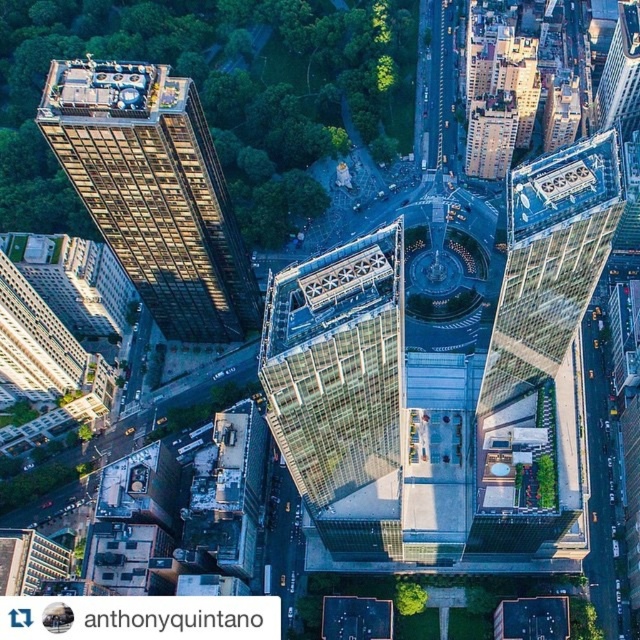
You are a city planner evaluating the urban skyline. You need to determine if the dark brown glass skyscraper at left will block the view of the transparent glass skyscraper at center from the park. Based on their heights, what do you conclude?

The dark brown glass skyscraper at left has a lesser height compared to transparent glass skyscraper at center, so it will not block the view of the transparent glass skyscraper at center from the park.

You are a drone operator flying over the city and need to deliver a package to the transparent glass skyscraper at center. However, you notice another dark brown glass skyscraper at left in your path. Based on your observation, which skyscraper is closer to you from your current position?

The dark brown glass skyscraper at left is closer to you because the transparent glass skyscraper at center is positioned behind it.

You are a drone operator tasked with flying a drone between the two skyscrapers. The drone has a maximum flight distance of 200 meters. Can you safely fly the drone between the dark brown glass skyscraper at left and the other skyscraper?

The distance between the dark brown glass skyscraper at left and the other skyscraper is 217.67 meters, which exceeds the drone maximum flight distance of 200 meters. Therefore, the drone cannot safely fly between them.